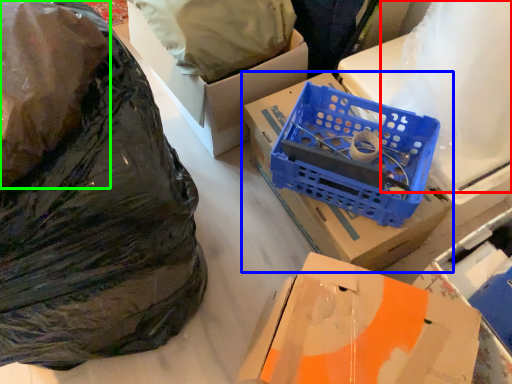
Question: Which object is positioned closest to wrapping paper (highlighted by a red box)? Select from box (highlighted by a blue box) and plastic bag (highlighted by a green box).

Choices:
 (A) box
 (B) plastic bag

Answer: (A)